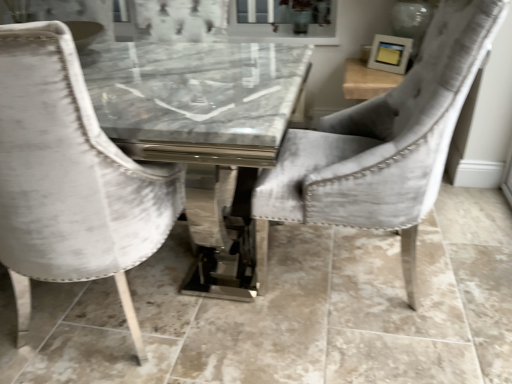
The image size is (512, 384). I want to click on vacant space that is in between velvet white chair at left, which is the first chair in left-to-right order, and velvet gray chair at center, the 2th chair positioned from the left, so click(x=258, y=324).